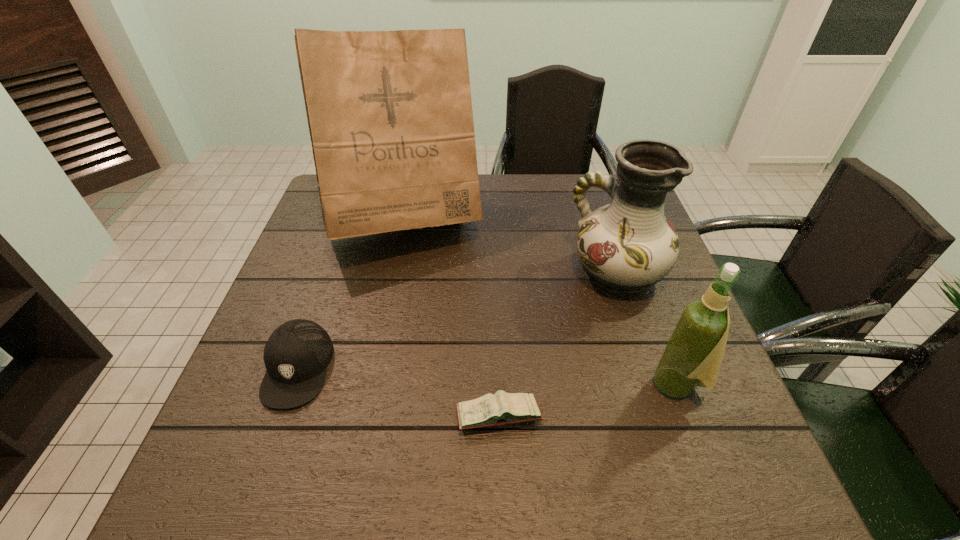
Locate an element on the screen. free space between the cap and the wine bottle is located at coordinates (488, 376).

In order to click on object that is the third closest one to the diary in this screenshot , I will do `click(296, 355)`.

I want to click on object that is the third nearest to the cap, so click(x=628, y=245).